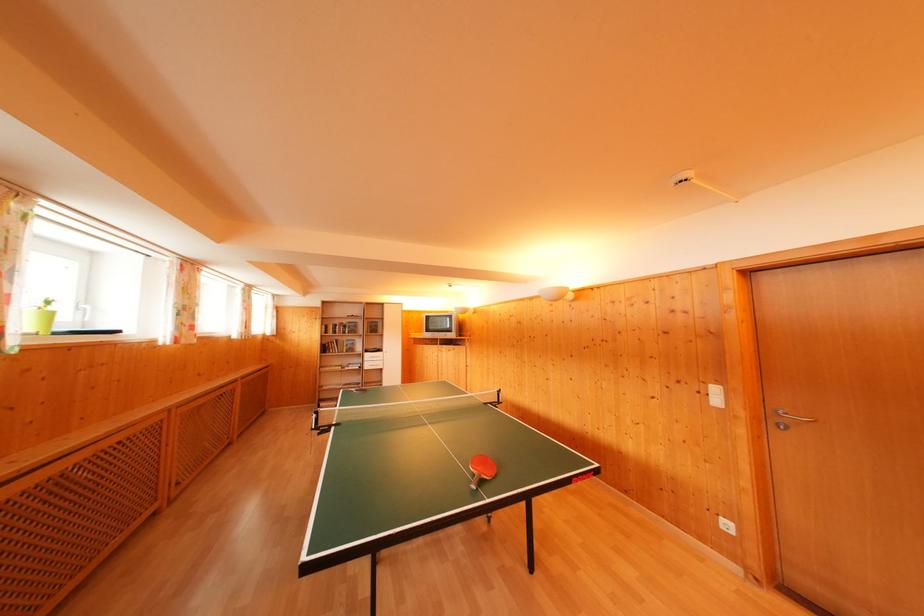
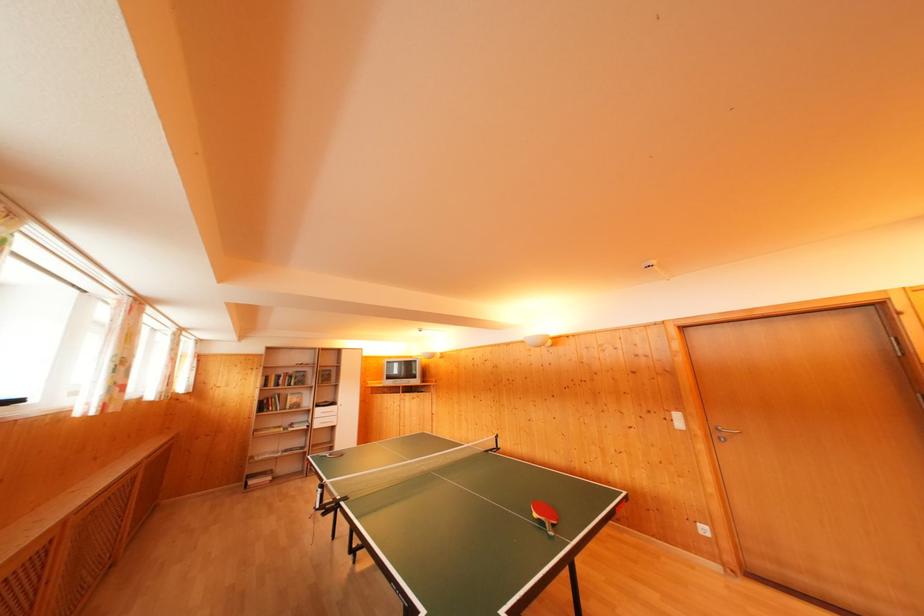
Question: The first image is from the beginning of the video and the second image is from the end. How did the camera likely rotate when shooting the video?

Choices:
 (A) Left
 (B) Right
 (C) Up
 (D) Down

Answer: (B)